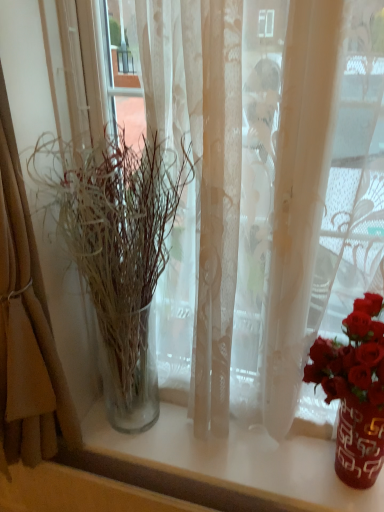
Question: Is translucent fabric curtain at left a part of translucent glass vase at left?

Choices:
 (A) no
 (B) yes

Answer: (A)

Question: Does translucent glass vase at left come in front of translucent fabric curtain at left?

Choices:
 (A) yes
 (B) no

Answer: (B)

Question: From a real-world perspective, is translucent glass vase at left on translucent fabric curtain at left?

Choices:
 (A) no
 (B) yes

Answer: (A)

Question: From the image's perspective, is translucent glass vase at left under translucent fabric curtain at left?

Choices:
 (A) yes
 (B) no

Answer: (A)

Question: Does translucent glass vase at left have a lesser height compared to translucent fabric curtain at left?

Choices:
 (A) no
 (B) yes

Answer: (B)

Question: Are translucent glass vase at left and translucent fabric curtain at left making contact?

Choices:
 (A) no
 (B) yes

Answer: (A)

Question: Is translucent fabric curtain at left further to the viewer compared to translucent glass vase at left?

Choices:
 (A) no
 (B) yes

Answer: (A)

Question: From the image's perspective, would you say translucent fabric curtain at left is shown under translucent glass vase at left?

Choices:
 (A) yes
 (B) no

Answer: (B)

Question: Is translucent fabric curtain at left to the right of translucent glass vase at left from the viewer's perspective?

Choices:
 (A) yes
 (B) no

Answer: (B)

Question: Considering the relative positions of translucent fabric curtain at left and translucent glass vase at left in the image provided, is translucent fabric curtain at left in front of translucent glass vase at left?

Choices:
 (A) yes
 (B) no

Answer: (A)

Question: Would you consider translucent fabric curtain at left to be distant from translucent glass vase at left?

Choices:
 (A) yes
 (B) no

Answer: (B)

Question: Is translucent fabric curtain at left outside translucent glass vase at left?

Choices:
 (A) no
 (B) yes

Answer: (B)

Question: Is translucent glass vase at left spatially inside translucent fabric curtain at left, or outside of it?

Choices:
 (A) inside
 (B) outside

Answer: (B)